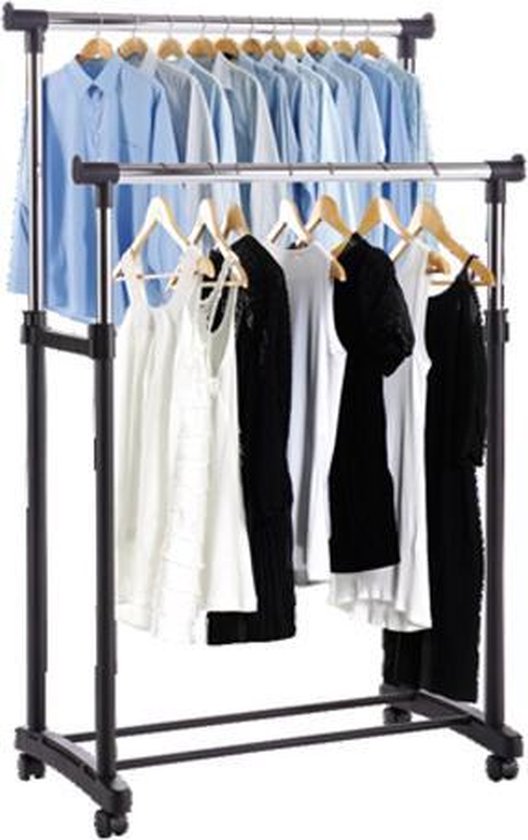
Where is `casters on rack`? casters on rack is located at coordinates 114,828, 34,770, 400,714, 508,763.